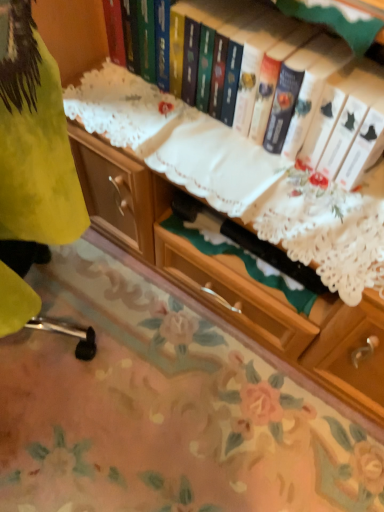
Question: Can you see floral-patterned fabric at lower center touching hardcover book at upper center?

Choices:
 (A) no
 (B) yes

Answer: (A)

Question: Is floral-patterned fabric at lower center further to camera compared to hardcover book at upper center?

Choices:
 (A) no
 (B) yes

Answer: (B)

Question: Is floral-patterned fabric at lower center far from hardcover book at upper center?

Choices:
 (A) yes
 (B) no

Answer: (B)

Question: From the image's perspective, would you say floral-patterned fabric at lower center is positioned over hardcover book at upper center?

Choices:
 (A) no
 (B) yes

Answer: (A)

Question: Considering the relative sizes of floral-patterned fabric at lower center and hardcover book at upper center in the image provided, is floral-patterned fabric at lower center taller than hardcover book at upper center?

Choices:
 (A) yes
 (B) no

Answer: (B)

Question: From a real-world perspective, is floral-patterned fabric at lower center located higher than hardcover book at upper center?

Choices:
 (A) no
 (B) yes

Answer: (A)

Question: Is hardcover book at upper center looking in the opposite direction of floral-patterned fabric at lower center?

Choices:
 (A) yes
 (B) no

Answer: (B)

Question: Is hardcover book at upper center facing towards floral-patterned fabric at lower center?

Choices:
 (A) yes
 (B) no

Answer: (B)

Question: From the image's perspective, would you say hardcover book at upper center is shown under floral-patterned fabric at lower center?

Choices:
 (A) yes
 (B) no

Answer: (B)

Question: Considering the relative sizes of hardcover book at upper center and floral-patterned fabric at lower center in the image provided, is hardcover book at upper center smaller than floral-patterned fabric at lower center?

Choices:
 (A) yes
 (B) no

Answer: (A)

Question: Is hardcover book at upper center with floral-patterned fabric at lower center?

Choices:
 (A) no
 (B) yes

Answer: (A)

Question: Does hardcover book at upper center have a lesser height compared to floral-patterned fabric at lower center?

Choices:
 (A) no
 (B) yes

Answer: (A)

Question: In the image, is floral-patterned fabric at lower center on the left side or the right side of hardcover book at upper center?

Choices:
 (A) right
 (B) left

Answer: (B)